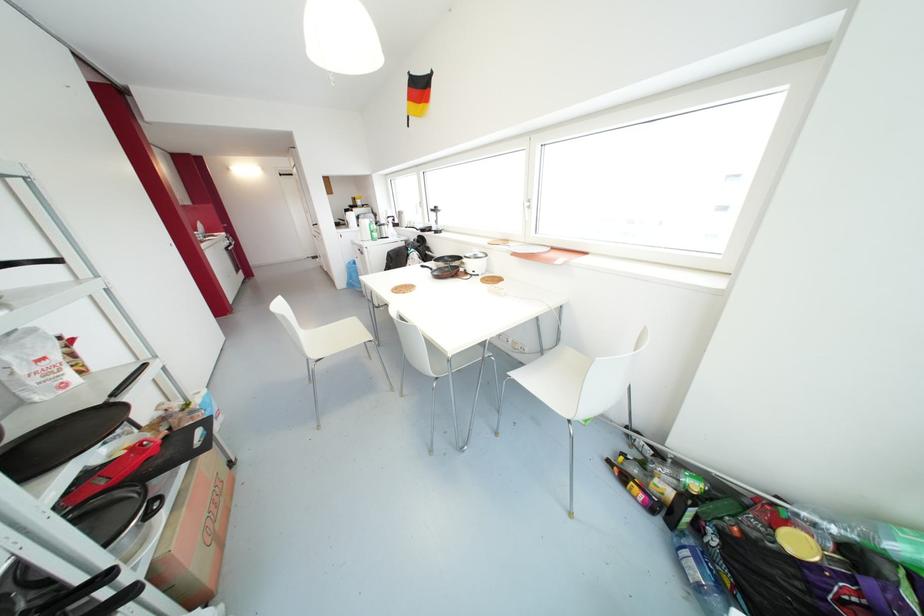
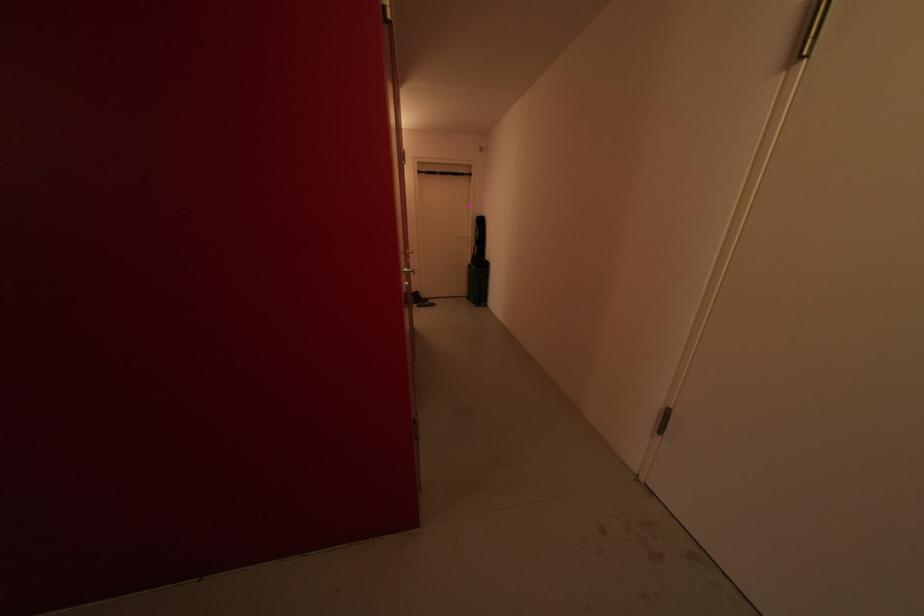
Question: I am providing you with two images of the same scene from different viewpoints. After the viewpoint changes to image2, which objects are now occluded?

Choices:
 (A) white paper bag
 (B) white door handle
 (C) red and black folder
 (D) doorway pull-up bar

Answer: (A)